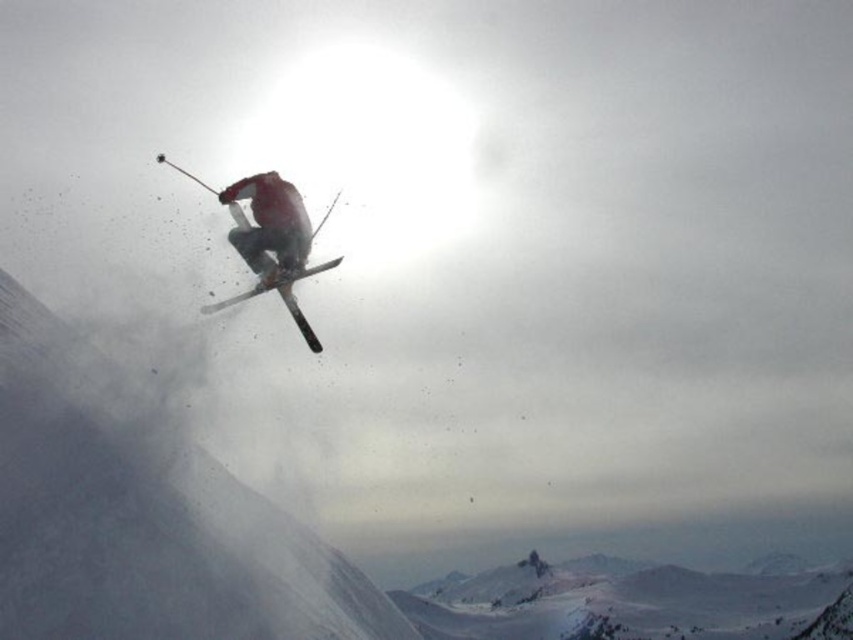
Is point (259, 269) positioned in front of point (305, 332)?

Yes.

Is matte red ski suit at center taller than shiny metallic ski at center?

Correct, matte red ski suit at center is much taller as shiny metallic ski at center.

Find the location of `matte red ski suit at center`. matte red ski suit at center is located at coordinates (270, 225).

Which is more to the right, matte red ski suit at center or shiny red snowboard at center?

From the viewer's perspective, matte red ski suit at center appears more on the right side.

Is matte red ski suit at center taller than shiny red snowboard at center?

In fact, matte red ski suit at center may be shorter than shiny red snowboard at center.

This screenshot has width=853, height=640. What do you see at coordinates (270, 225) in the screenshot? I see `matte red ski suit at center` at bounding box center [270, 225].

The height and width of the screenshot is (640, 853). I want to click on matte red ski suit at center, so click(270, 225).

Between shiny red snowboard at center and shiny metallic ski at center, which one appears on the right side from the viewer's perspective?

Positioned to the right is shiny metallic ski at center.

Is shiny red snowboard at center bigger than shiny metallic ski at center?

Yes.

Find the location of `shiny red snowboard at center`. shiny red snowboard at center is located at coordinates (299, 316).

At what (x,y) coordinates should I click in order to perform the action: click on shiny red snowboard at center. Please return your answer as a coordinate pair (x, y). Looking at the image, I should click on (299, 316).